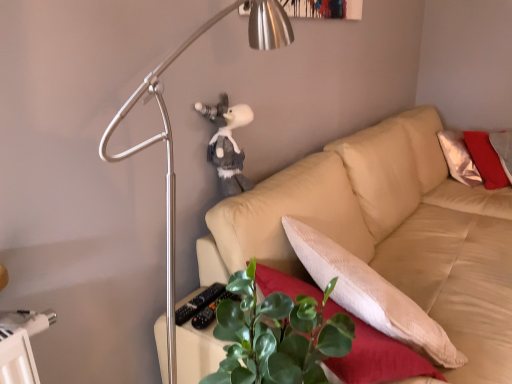
Find the location of a particular element. The height and width of the screenshot is (384, 512). free space to the right of white plush toy at upper center is located at coordinates (278, 190).